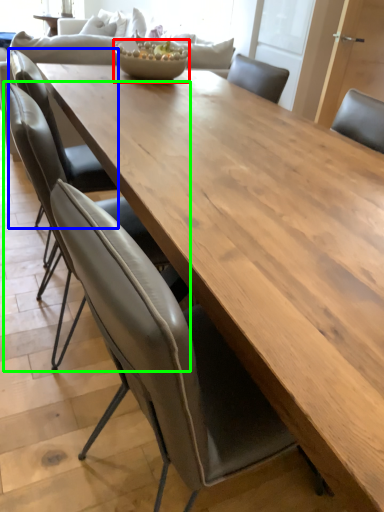
Question: Estimate the real-world distances between objects in this image. Which object is closer to salad bowl (highlighted by a red box), chair (highlighted by a blue box) or chair (highlighted by a green box)?

Choices:
 (A) chair
 (B) chair

Answer: (A)